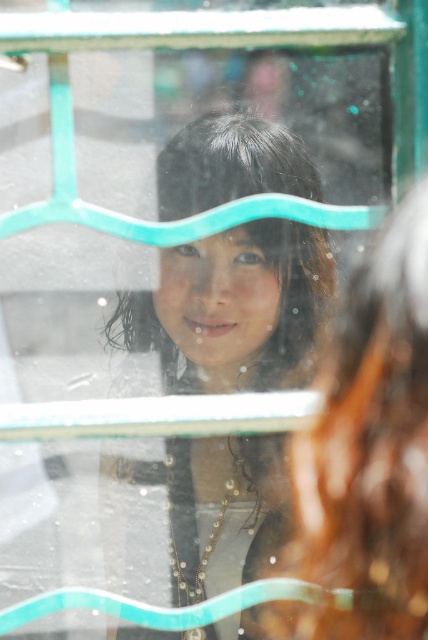
You are looking through a window with a green frame and notice two strands of hair. Which one is more to the left between the smooth black hair at center and the smooth brown hair at upper center?

The smooth black hair at center is more to the left than the smooth brown hair at upper center.

You are a photographer trying to capture a portrait through the window with a green frame. The subject has two distinct strands of hair visible through the window. The strands are labeled as smooth black hair at center and smooth brown hair at upper center. Given that the distance between these two strands is 8.84 inches, can you estimate whether the photographer can clearly capture both strands separately in the final photo?

The smooth black hair at center and smooth brown hair at upper center are 8.84 inches apart. Since this distance is relatively large, the photographer should be able to clearly capture both strands separately in the final photo.